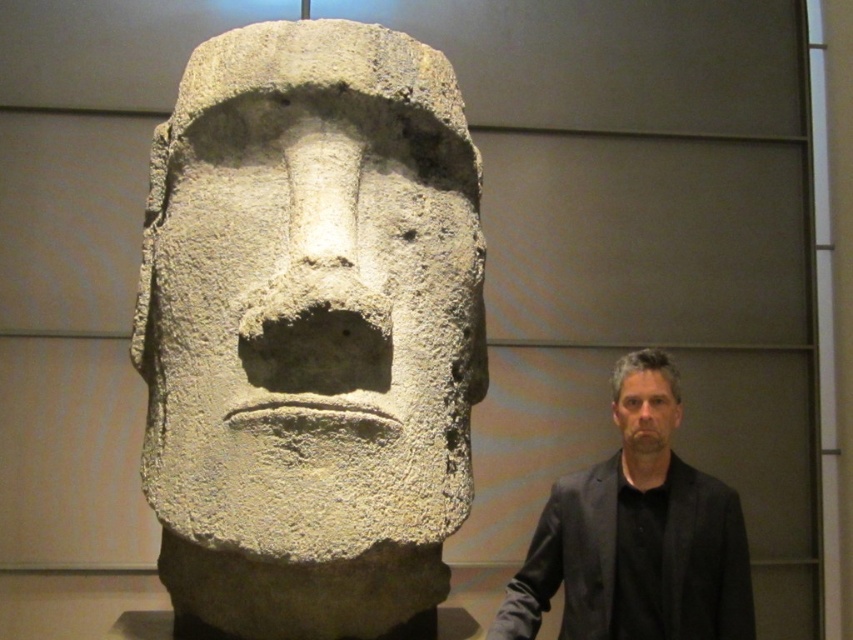
You are standing in front of the white stone sculpture at center and want to take a photo of it. If your camera has a maximum focus range of 4 meters, will you be able to capture the sculpture clearly?

The white stone sculpture at center is 4.40 meters away from the viewer. Since the camera can only focus up to 4 meters, it will not be able to capture the sculpture clearly.

You are an art curator planning to display both the white stone sculpture at center and the smooth gray stone head at center in a gallery. Given their sizes, which one should be placed in a larger exhibition space to accommodate its dimensions?

The white stone sculpture at center is larger in size than the smooth gray stone head at center, so it should be placed in a larger exhibition space to accommodate its dimensions.